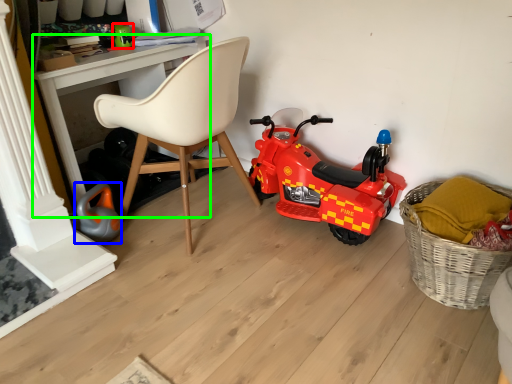
Question: Estimate the real-world distances between objects in this image. Which object is farther from toy (highlighted by a red box), toy (highlighted by a blue box) or desk (highlighted by a green box)?

Choices:
 (A) toy
 (B) desk

Answer: (A)